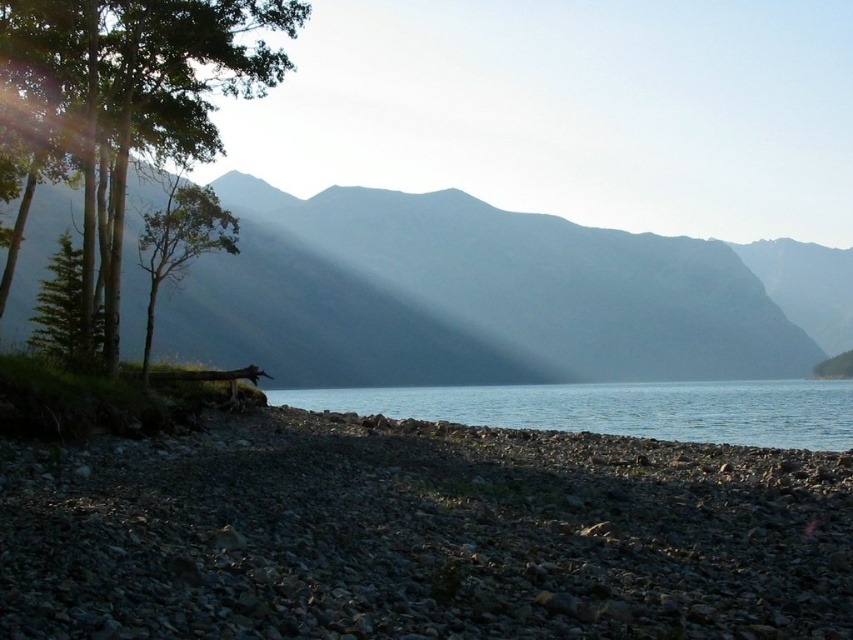
Which is below, green matte tree at left or clear water at center?

clear water at center

Is green matte tree at left positioned behind clear water at center?

No, it is not.

Is point (207, 118) farther from viewer compared to point (744, 408)?

No.

What are the coordinates of `green matte tree at left` in the screenshot? It's located at (135, 97).

What do you see at coordinates (473, 298) in the screenshot?
I see `smooth gray mountain at center` at bounding box center [473, 298].

Can you confirm if smooth gray mountain at center is bigger than clear water at center?

Yes.

What do you see at coordinates (473, 298) in the screenshot?
I see `smooth gray mountain at center` at bounding box center [473, 298].

Where is `smooth gray mountain at center`? smooth gray mountain at center is located at coordinates (473, 298).

Between point (730, 273) and point (48, 81), which one is positioned in front?

Point (48, 81) is in front.

Who is positioned more to the right, smooth gray mountain at center or green matte tree at left?

Positioned to the right is smooth gray mountain at center.

Which is in front, point (357, 257) or point (67, 52)?

Positioned in front is point (67, 52).

Find the location of `smooth gray mountain at center`. smooth gray mountain at center is located at coordinates (473, 298).